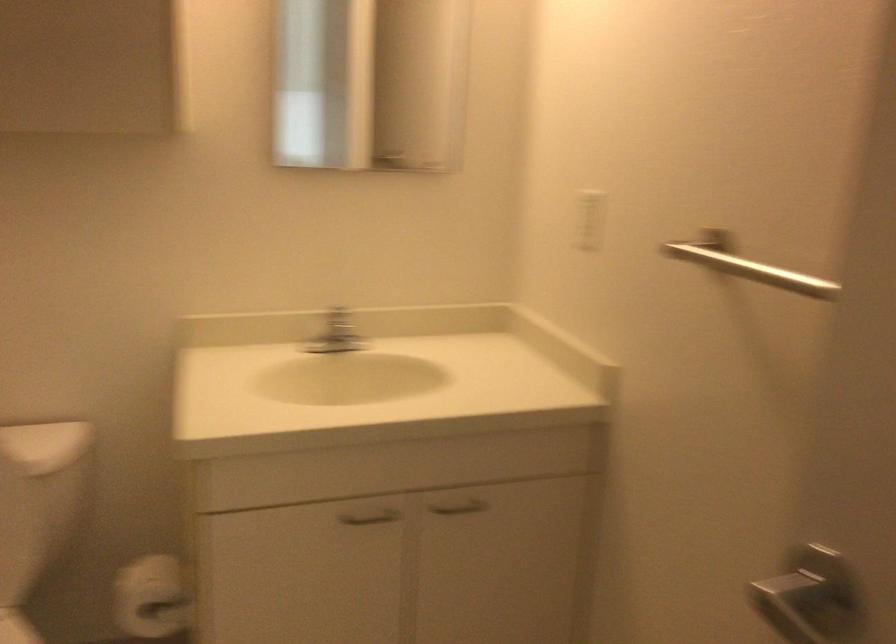
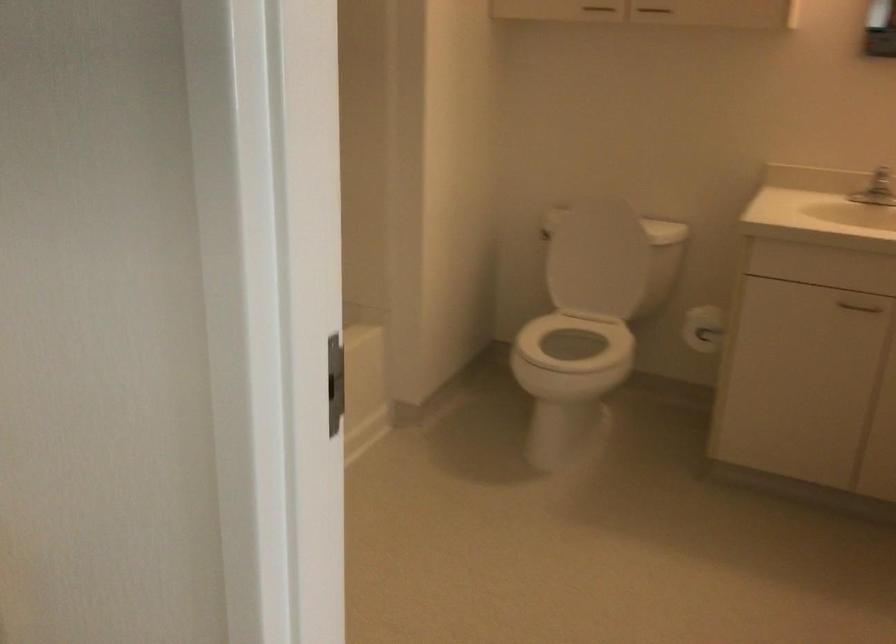
Where in the second image is the point corresponding to the point at 351,327 from the first image?

(881, 182)